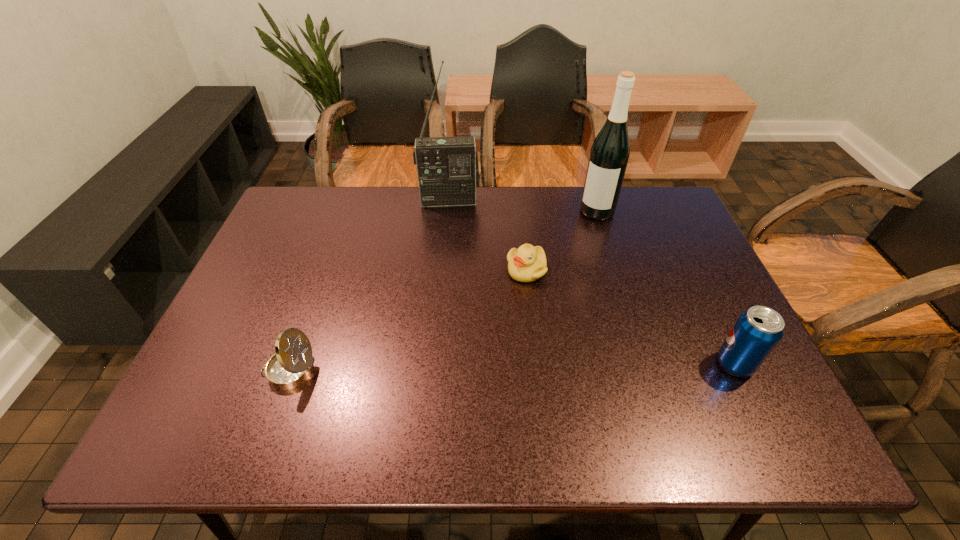
Identify the location of radio receiver that is at the far edge. (448, 171).

This screenshot has width=960, height=540. What are the coordinates of `compass that is at the near edge` in the screenshot? It's located at (292, 364).

Identify the location of pop soda positioned at the near edge. This screenshot has height=540, width=960. (757, 331).

The width and height of the screenshot is (960, 540). Identify the location of object that is at the left edge. (292, 364).

The image size is (960, 540). In order to click on object that is at the right edge in this screenshot , I will do [757, 331].

This screenshot has width=960, height=540. Identify the location of object present at the near left corner. pyautogui.click(x=292, y=364).

Where is `object that is at the near right corner`? The image size is (960, 540). object that is at the near right corner is located at coordinates (757, 331).

Image resolution: width=960 pixels, height=540 pixels. Find the location of `vacant space at the far edge`. vacant space at the far edge is located at coordinates (568, 202).

What are the coordinates of `vacant space at the near edge of the desktop` in the screenshot? It's located at 268,403.

I want to click on vacant point at the left edge, so click(241, 296).